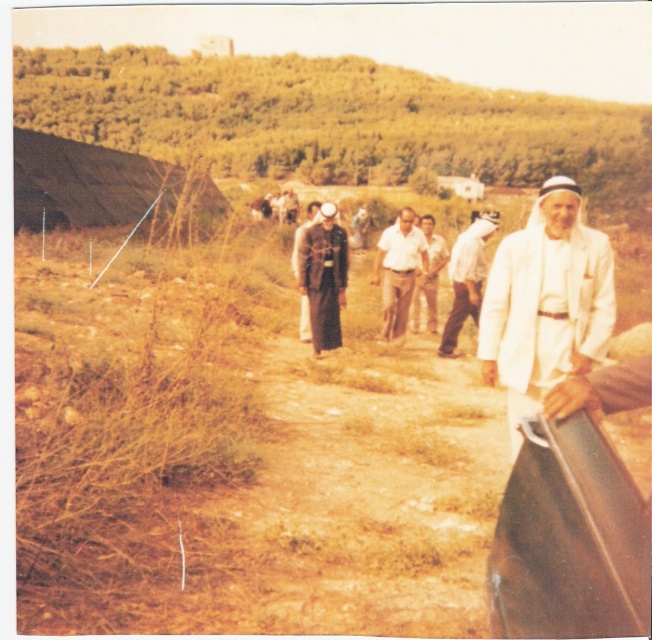
You are standing in the rural field scene and need to reach both the white matte jacket at lower right and the light brown leather jacket at center. Which jacket should you approach first to minimize the distance walked?

You should approach the white matte jacket at lower right first since it is closer to you than the light brown leather jacket at center, reducing the total distance walked.

You are a photographer trying to capture both the dark gray uniform at center and the light brown cotton shirt at center in the same frame. Since you want to emphasize the size difference between them, which one should you position closer to the camera?

The dark gray uniform at center is larger in size compared to the light brown cotton shirt at center. To emphasize their size difference, position the light brown cotton shirt at center closer to the camera so that both appear similar in size in the photo, highlighting the actual size disparity.